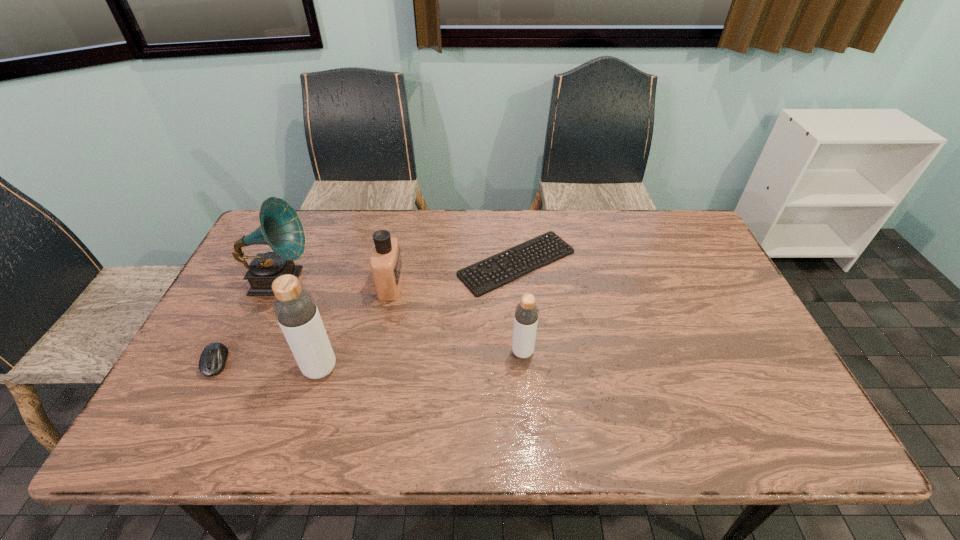
In the image, there is a desktop. At what (x,y) coordinates should I click in order to perform the action: click on vacant space at the near edge. Please return your answer as a coordinate pair (x, y). Looking at the image, I should click on (352, 395).

This screenshot has height=540, width=960. Identify the location of blank area at the left edge. (267, 303).

In the image, there is a desktop. Where is `free space at the right edge`? This screenshot has width=960, height=540. free space at the right edge is located at coordinates (754, 343).

The width and height of the screenshot is (960, 540). I want to click on vacant region at the near left corner of the desktop, so click(215, 402).

This screenshot has width=960, height=540. I want to click on vacant point at the near right corner, so click(778, 407).

You are a GUI agent. You are given a task and a screenshot of the screen. Output one action in this format:
    pyautogui.click(x=<x>, y=<y>)
    Task: Click on the free spot between the perfume and the phonograph_record
    
    Given the screenshot: What is the action you would take?
    pyautogui.click(x=335, y=283)

Find the location of a particular element. This screenshot has width=960, height=540. unoccupied area between the taller bottle and the computer keyboard is located at coordinates (419, 315).

Identify the location of free space between the third object from right to left and the phonograph_record. (335, 283).

In order to click on free area in between the shorter bottle and the phonograph_record in this screenshot , I will do 401,316.

Identify the location of vacant region between the phonograph_record and the fourth object from left to right. Image resolution: width=960 pixels, height=540 pixels. pos(335,283).